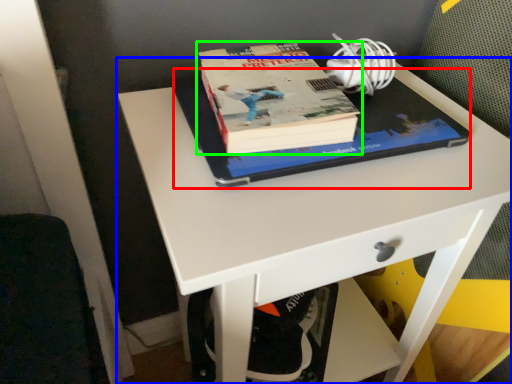
Question: Estimate the real-world distances between objects in this image. Which object is farther from notebook (highlighted by a red box), desk (highlighted by a blue box) or book (highlighted by a green box)?

Choices:
 (A) desk
 (B) book

Answer: (A)